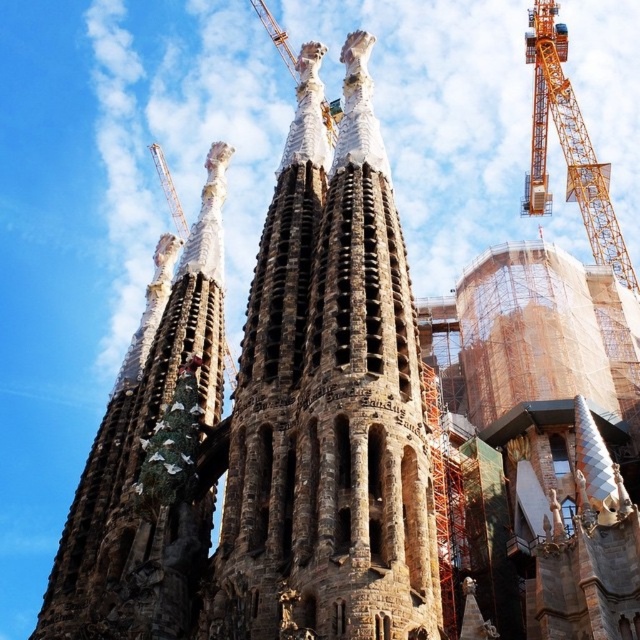
You are a construction worker who needs to move a 100 meter long steel beam from the yellow metallic crane at upper right to the brown stone tower at center. Can you safely transport it without the beam touching the ground?

The distance between the brown stone tower at center and the yellow metallic crane at upper right is 82.05 meters. Since the steel beam is 100 meters long, it would be too long to transport safely without touching the ground over this distance.

You are a tourist standing in front of the Sagrada Familia. You see the brown stone tower at center and the yellow metallic crane at upper right. Which object is closer to you?

The brown stone tower at center is closer to the viewer than the yellow metallic crane at upper right.